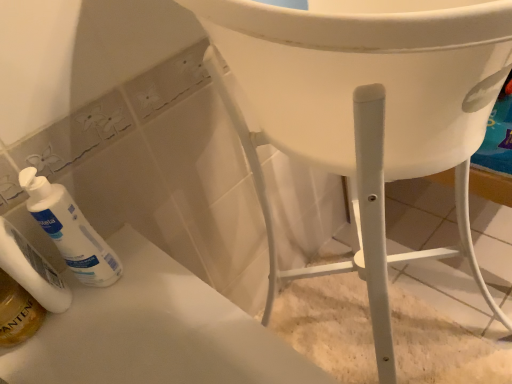
Question: From the image's perspective, is translucent golden mouthwash at lower left beneath white plastic chair at lower right?

Choices:
 (A) no
 (B) yes

Answer: (A)

Question: From a real-world perspective, is translucent golden mouthwash at lower left beneath white plastic chair at lower right?

Choices:
 (A) no
 (B) yes

Answer: (A)

Question: Does translucent golden mouthwash at lower left have a smaller size compared to white plastic chair at lower right?

Choices:
 (A) no
 (B) yes

Answer: (B)

Question: Is translucent golden mouthwash at lower left behind white plastic chair at lower right?

Choices:
 (A) yes
 (B) no

Answer: (B)

Question: Can you see translucent golden mouthwash at lower left touching white plastic chair at lower right?

Choices:
 (A) yes
 (B) no

Answer: (B)

Question: Looking at their shapes, would you say white matte pump bottle at lower left is wider or thinner than white plastic chair at lower right?

Choices:
 (A) wide
 (B) thin

Answer: (B)

Question: In terms of height, does white matte pump bottle at lower left look taller or shorter compared to white plastic chair at lower right?

Choices:
 (A) tall
 (B) short

Answer: (A)

Question: In the image, is white matte pump bottle at lower left positioned in front of or behind white plastic chair at lower right?

Choices:
 (A) behind
 (B) front

Answer: (B)

Question: Looking at the image, does white matte pump bottle at lower left seem bigger or smaller compared to white plastic chair at lower right?

Choices:
 (A) small
 (B) big

Answer: (A)

Question: From a real-world perspective, is white matte lotion at lower left above or below white plastic chair at lower right?

Choices:
 (A) above
 (B) below

Answer: (A)

Question: In terms of height, does white matte lotion at lower left look taller or shorter compared to white plastic chair at lower right?

Choices:
 (A) tall
 (B) short

Answer: (A)

Question: Is white matte lotion at lower left wider or thinner than white plastic chair at lower right?

Choices:
 (A) thin
 (B) wide

Answer: (A)

Question: Based on their sizes in the image, would you say white matte lotion at lower left is bigger or smaller than white plastic chair at lower right?

Choices:
 (A) small
 (B) big

Answer: (A)

Question: In the image, is translucent golden mouthwash at lower left on the left side or the right side of white matte pump bottle at lower left?

Choices:
 (A) left
 (B) right

Answer: (A)

Question: Is point (33, 304) positioned closer to the camera than point (94, 276)?

Choices:
 (A) closer
 (B) farther

Answer: (A)